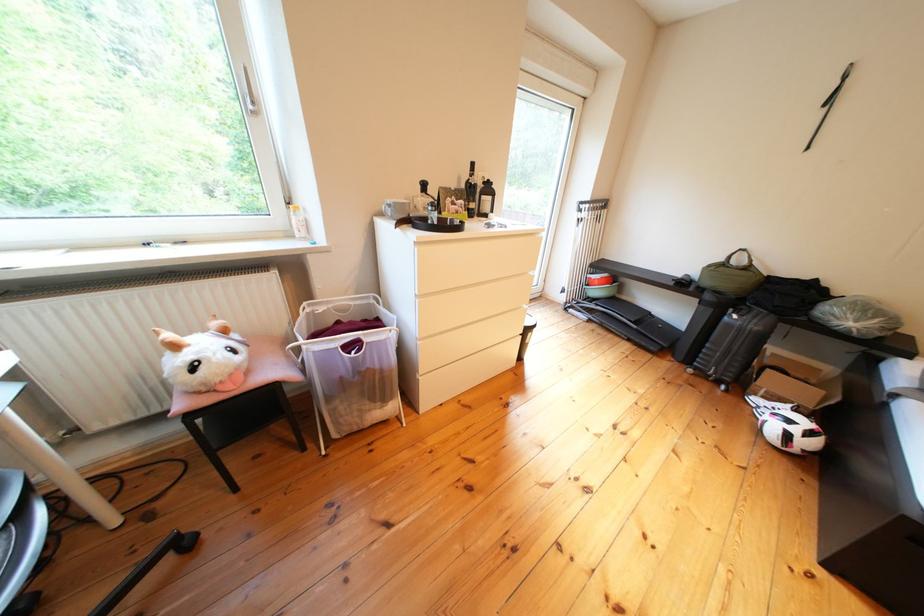
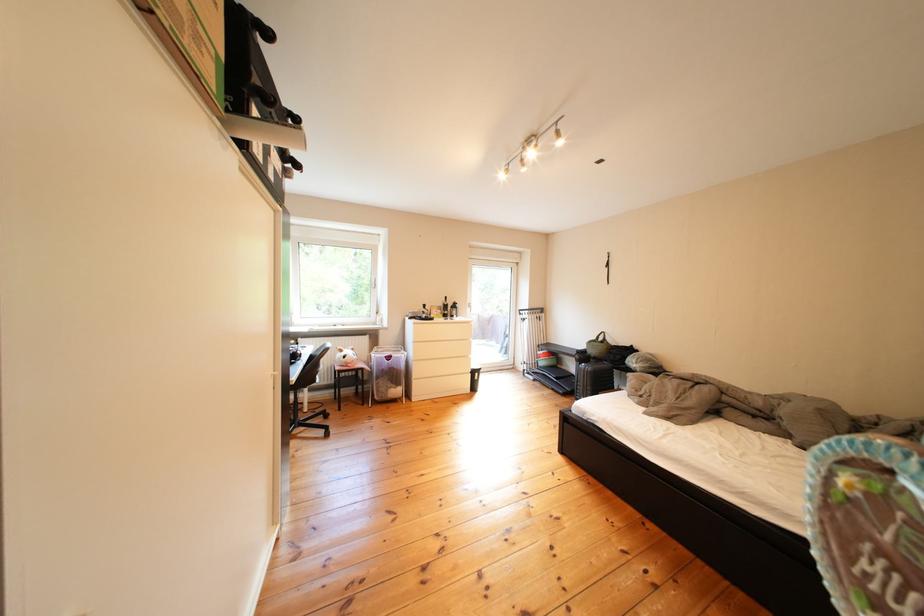
Find the pixel in the second image that matches (208,371) in the first image.

(359, 361)